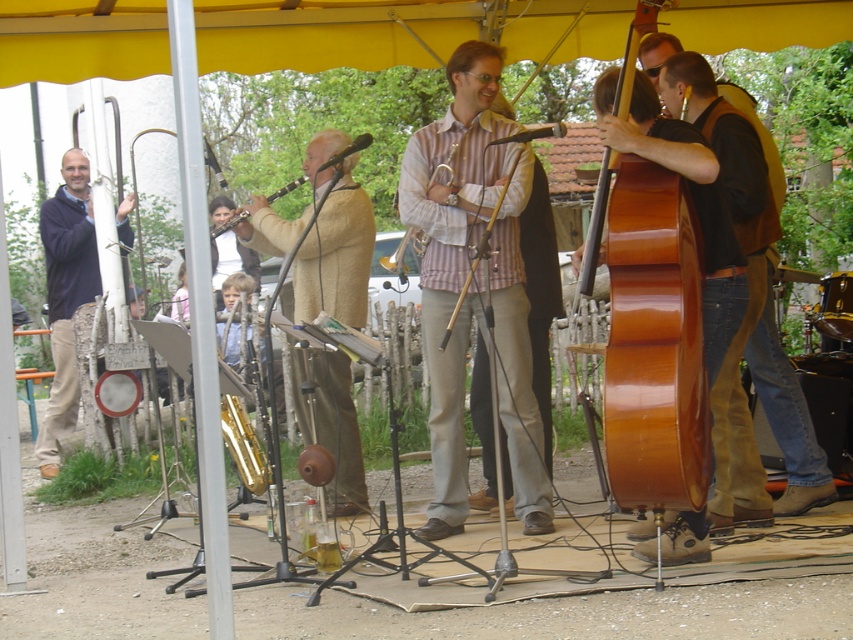
You are a photographer trying to capture a clear shot of both the light beige wool sweater at center and the matte wood clarinet at center. Since both are at the same central position, which one will appear bigger in your photo?

The light beige wool sweater at center will appear bigger in the photo because it has a larger size compared to the matte wood clarinet at center.

You are a photographer standing at the back of the audience. You want to take a photo of both the striped cotton shirt at center and the shiny brown cello at center. Which object will appear closer to you in the photo?

The striped cotton shirt at center will appear closer to you in the photo because it is positioned closer to the viewer than the shiny brown cello at center.